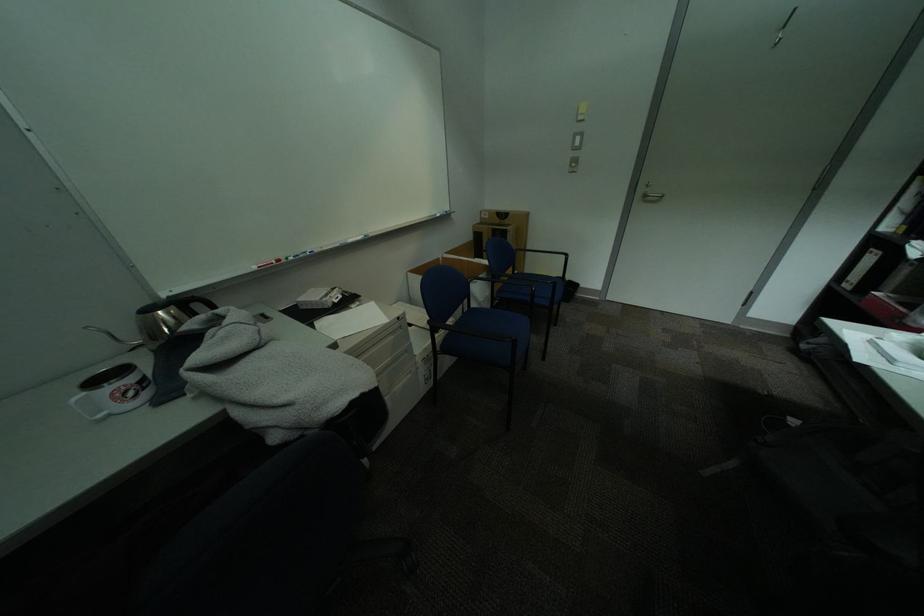
What do you see at coordinates (439, 336) in the screenshot?
I see `the black chair armrest` at bounding box center [439, 336].